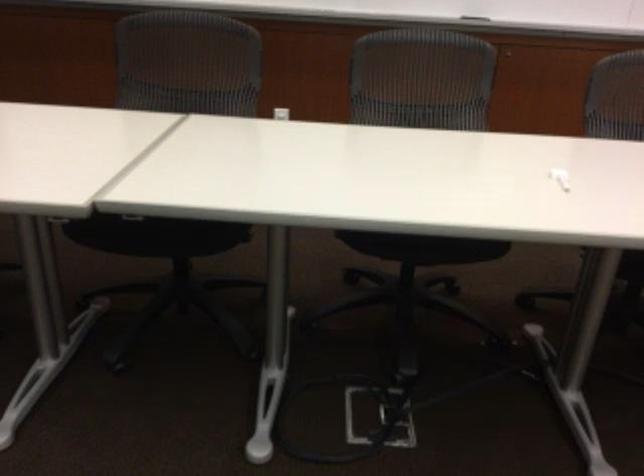
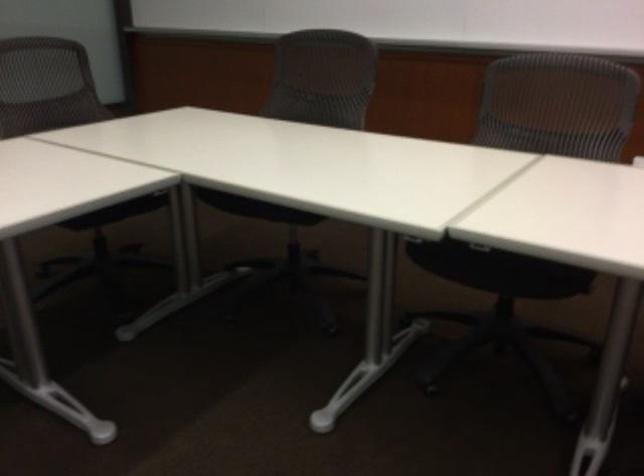
Question: How did the camera likely rotate?

Choices:
 (A) Left
 (B) Right
 (C) Up
 (D) Down

Answer: (A)